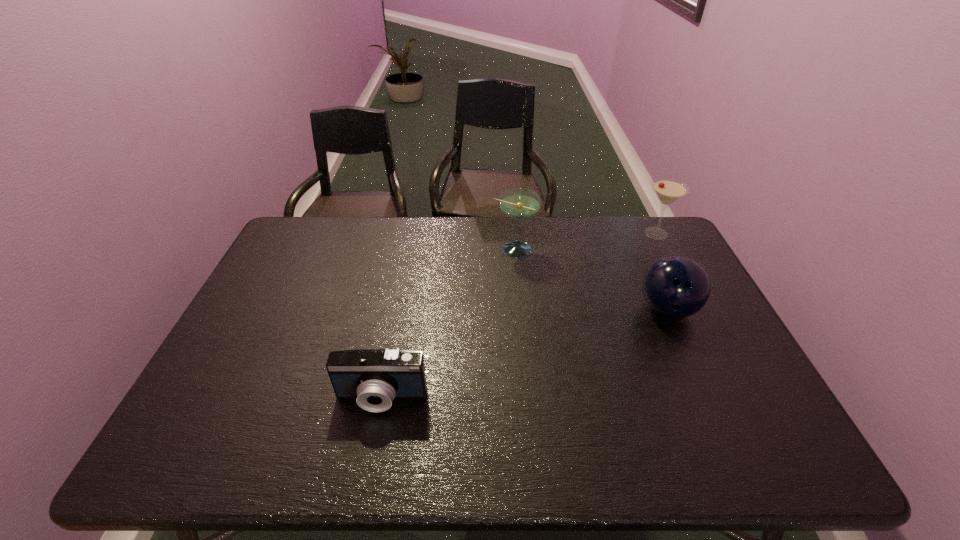
At what (x,y) coordinates should I click in order to perform the action: click on the left martini. Please return your answer as a coordinate pair (x, y). Image resolution: width=960 pixels, height=540 pixels. Looking at the image, I should click on (518, 203).

In order to click on the right martini in this screenshot , I will do `click(668, 190)`.

Where is `the third farthest object`? The height and width of the screenshot is (540, 960). the third farthest object is located at coordinates (676, 287).

Image resolution: width=960 pixels, height=540 pixels. I want to click on camcorder, so pyautogui.click(x=375, y=377).

At what (x,y) coordinates should I click in order to perform the action: click on the leftmost object. Please return your answer as a coordinate pair (x, y). Looking at the image, I should click on (375, 377).

The image size is (960, 540). In order to click on blank space located 0.350m on the right of the third object from right to left in this screenshot , I will do `click(640, 249)`.

Find the location of a particular element. This screenshot has height=540, width=960. free space located 0.060m on the left of the right martini is located at coordinates (622, 233).

Locate an element on the screen. This screenshot has width=960, height=540. vacant region located 0.140m on the surface of the third farthest object near the finger holes is located at coordinates (696, 373).

Where is `free region located 0.050m on the lens of the nearest object`? The width and height of the screenshot is (960, 540). free region located 0.050m on the lens of the nearest object is located at coordinates (374, 436).

Find the location of `martini that is positioned at the right edge`. martini that is positioned at the right edge is located at coordinates (668, 190).